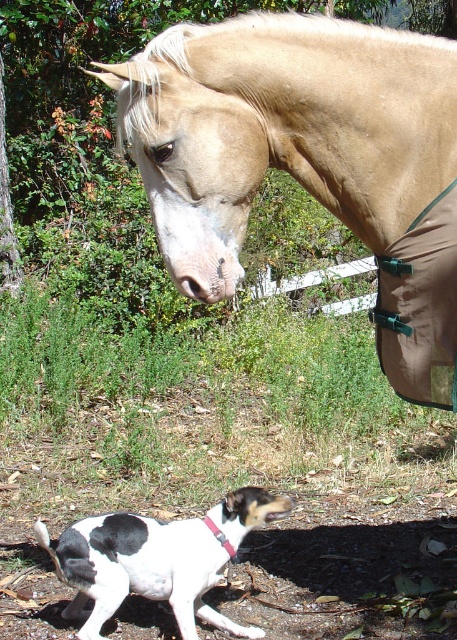
Question: Is black and white fur at lower left thinner than brown/cotton blanket at lower right?

Choices:
 (A) yes
 (B) no

Answer: (B)

Question: Which of these objects is positioned closest to the brown/cotton blanket at lower right?

Choices:
 (A) black and white fur at lower left
 (B) light brown horse at upper center

Answer: (B)

Question: Which of the following is the closest to the observer?

Choices:
 (A) light brown horse at upper center
 (B) brown/cotton blanket at lower right
 (C) black and white fur at lower left

Answer: (A)

Question: Which of these objects is positioned closest to the black and white fur at lower left?

Choices:
 (A) brown/cotton blanket at lower right
 (B) light brown horse at upper center

Answer: (A)

Question: Is black and white fur at lower left closer to the viewer compared to brown/cotton blanket at lower right?

Choices:
 (A) no
 (B) yes

Answer: (A)

Question: Is light brown horse at upper center to the left of black and white fur at lower left from the viewer's perspective?

Choices:
 (A) no
 (B) yes

Answer: (A)